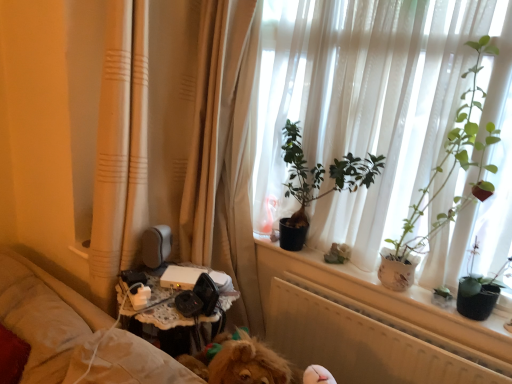
Question: In the image, is green matte plant at center, acting as the first houseplant starting from the left, positioned in front of or behind beige fabric curtain at left?

Choices:
 (A) front
 (B) behind

Answer: (B)

Question: Is green matte plant at center, the 2th houseplant positioned from the right, bigger or smaller than beige fabric curtain at left?

Choices:
 (A) small
 (B) big

Answer: (A)

Question: Based on their relative distances, which object is farther from the green matte plant at center, the 2th houseplant positioned from the right?

Choices:
 (A) green matte plant at upper right, which is counted as the 1th houseplant, starting from the right
 (B) beige fabric curtain at left

Answer: (A)

Question: Which of these objects is positioned farthest from the green matte plant at center, acting as the first houseplant starting from the left?

Choices:
 (A) green matte plant at upper right, placed as the 2th houseplant when sorted from left to right
 (B) beige fabric curtain at left

Answer: (A)